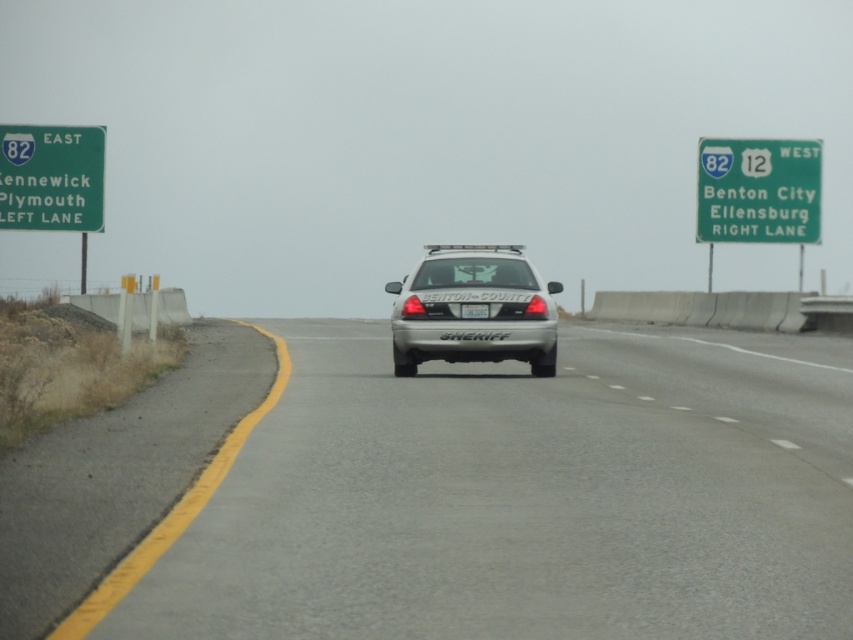
Is point (361, 362) farther from camera compared to point (509, 307)?

Yes, it is.

Can you confirm if gray asphalt road at center is thinner than silver metallic sheriff car at center?

In fact, gray asphalt road at center might be wider than silver metallic sheriff car at center.

What do you see at coordinates (527, 497) in the screenshot? I see `gray asphalt road at center` at bounding box center [527, 497].

Where is `gray asphalt road at center`? Image resolution: width=853 pixels, height=640 pixels. gray asphalt road at center is located at coordinates (527, 497).

Can you confirm if silver metallic sheriff car at center is positioned below white plastic license plate at center?

No, silver metallic sheriff car at center is not below white plastic license plate at center.

What do you see at coordinates (473, 301) in the screenshot? This screenshot has width=853, height=640. I see `silver metallic sheriff car at center` at bounding box center [473, 301].

Where is `silver metallic sheriff car at center`? This screenshot has width=853, height=640. silver metallic sheriff car at center is located at coordinates (473, 301).

Is green plastic sign at left positioned behind white plastic license plate at center?

Yes, it is behind white plastic license plate at center.

Which is behind, point (39, 134) or point (479, 310)?

Positioned behind is point (39, 134).

Where is `green plastic sign at left`? green plastic sign at left is located at coordinates (51, 177).